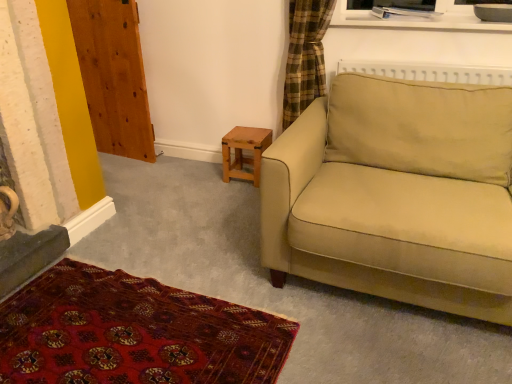
What are the coordinates of `beige fabric couch at right` in the screenshot? It's located at (396, 194).

Describe the element at coordinates (134, 333) in the screenshot. I see `carpet with intricate patterns at lower left` at that location.

The width and height of the screenshot is (512, 384). What do you see at coordinates (113, 76) in the screenshot?
I see `wooden at left` at bounding box center [113, 76].

This screenshot has height=384, width=512. I want to click on wooden stool at lower center, so click(x=242, y=153).

Considering the sizes of objects carpet with intricate patterns at lower left and wooden at left in the image provided, who is bigger, carpet with intricate patterns at lower left or wooden at left?

wooden at left is bigger.

Which object is thinner, carpet with intricate patterns at lower left or wooden at left?

Thinner between the two is wooden at left.

From the image's perspective, does carpet with intricate patterns at lower left appear higher than wooden at left?

No.

How different are the orientations of carpet with intricate patterns at lower left and wooden at left in degrees?

96.3 degrees.

What's the angular difference between wooden stool at lower center and beige fabric couch at right's facing directions?

The angle between the facing direction of wooden stool at lower center and the facing direction of beige fabric couch at right is 1.72 degrees.

How distant is wooden stool at lower center from beige fabric couch at right?

The distance of wooden stool at lower center from beige fabric couch at right is 36.25 inches.

In the scene shown: Is wooden stool at lower center beside beige fabric couch at right?

No.

This screenshot has width=512, height=384. What are the coordinates of `table that is above the beige fabric couch at right (from the image's perspective)` in the screenshot? It's located at (242, 153).

Between point (127, 34) and point (240, 139), which one is positioned in front?

The point (240, 139) is more forward.

Between wooden at left and wooden stool at lower center, which one appears on the right side from the viewer's perspective?

Positioned to the right is wooden stool at lower center.

Looking at this image, how many degrees apart are the facing directions of wooden at left and wooden stool at lower center?

The facing directions of wooden at left and wooden stool at lower center are 10.5 degrees apart.

Considering the sizes of wooden at left and wooden stool at lower center in the image, is wooden at left wider or thinner than wooden stool at lower center?

Considering their sizes, wooden at left looks slimmer than wooden stool at lower center.

Visually, is beige fabric couch at right positioned to the left or to the right of wooden stool at lower center?

beige fabric couch at right is positioned on wooden stool at lower center's right side.

Locate an element on the screen. table behind the beige fabric couch at right is located at coordinates (242, 153).

Is beige fabric couch at right looking in the opposite direction of wooden stool at lower center?

beige fabric couch at right does not have its back to wooden stool at lower center.

Which object is thinner, beige fabric couch at right or wooden stool at lower center?

With smaller width is wooden stool at lower center.

Consider the image. From a real-world perspective, which object stands above the other?

From a 3D spatial view, beige fabric couch at right is above.

Would you say beige fabric couch at right is part of carpet with intricate patterns at lower left's contents?

Definitely not — beige fabric couch at right is not inside carpet with intricate patterns at lower left.

Can you tell me how much carpet with intricate patterns at lower left and beige fabric couch at right differ in facing direction?

87.5 degrees separate the facing orientations of carpet with intricate patterns at lower left and beige fabric couch at right.

The image size is (512, 384). In order to click on plain below the beige fabric couch at right (from a real-world perspective) in this screenshot , I will do `click(134, 333)`.

Between beige fabric couch at right and carpet with intricate patterns at lower left, which one is positioned in front?

beige fabric couch at right.

From a real-world perspective, which object stands above the other?

beige fabric couch at right is physically above.

Between beige fabric couch at right and carpet with intricate patterns at lower left, which one has larger width?

Wider between the two is carpet with intricate patterns at lower left.

What's the angular difference between wooden at left and beige fabric couch at right's facing directions?

The angular difference between wooden at left and beige fabric couch at right is 8.74 degrees.

Is wooden at left directly adjacent to beige fabric couch at right?

wooden at left and beige fabric couch at right are not in contact.

Identify the location of armoire above the beige fabric couch at right (from a real-world perspective). This screenshot has height=384, width=512. [x=113, y=76].

From the picture: From the image's perspective, is wooden at left positioned above or below beige fabric couch at right?

Clearly, from the image's perspective, wooden at left is above beige fabric couch at right.

Identify the location of plain that appears below the wooden at left (from the image's perspective). (134, 333).

This screenshot has height=384, width=512. What are the coordinates of `table that appears behind the beige fabric couch at right` in the screenshot? It's located at (242, 153).

Estimate the real-world distances between objects in this image. Which object is closer to wooden stool at lower center, wooden at left or carpet with intricate patterns at lower left?

Among the two, wooden at left is located nearer to wooden stool at lower center.

When comparing their distances from wooden at left, does carpet with intricate patterns at lower left or wooden stool at lower center seem closer?

Based on the image, wooden stool at lower center appears to be nearer to wooden at left.

Which object lies further to the anchor point wooden at left, wooden stool at lower center or beige fabric couch at right?

beige fabric couch at right.

Based on their spatial positions, is carpet with intricate patterns at lower left or wooden at left further from wooden stool at lower center?

carpet with intricate patterns at lower left is positioned further to the anchor wooden stool at lower center.

Looking at the image, which one is located closer to wooden stool at lower center, carpet with intricate patterns at lower left or beige fabric couch at right?

beige fabric couch at right is closer to wooden stool at lower center.

Which object lies further to the anchor point carpet with intricate patterns at lower left, wooden at left or beige fabric couch at right?

Among the two, wooden at left is located further to carpet with intricate patterns at lower left.

In the scene shown: Which object lies nearer to the anchor point beige fabric couch at right, wooden at left or carpet with intricate patterns at lower left?

Among the two, carpet with intricate patterns at lower left is located nearer to beige fabric couch at right.

Which object lies nearer to the anchor point wooden at left, beige fabric couch at right or carpet with intricate patterns at lower left?

The object closer to wooden at left is carpet with intricate patterns at lower left.

You are a GUI agent. You are given a task and a screenshot of the screen. Output one action in this format:
    pyautogui.click(x=<x>, y=<y>)
    Task: Click on the armoire between carpet with intricate patterns at lower left and wooden stool at lower center from front to back
    This screenshot has height=384, width=512.
    Given the screenshot: What is the action you would take?
    pyautogui.click(x=113, y=76)

The image size is (512, 384). Find the location of `plain located between wooden at left and beige fabric couch at right in the left-right direction`. plain located between wooden at left and beige fabric couch at right in the left-right direction is located at coordinates (134, 333).

Image resolution: width=512 pixels, height=384 pixels. Find the location of `plain positioned between beige fabric couch at right and wooden stool at lower center from near to far`. plain positioned between beige fabric couch at right and wooden stool at lower center from near to far is located at coordinates (134, 333).

This screenshot has width=512, height=384. Identify the location of table between wooden at left and beige fabric couch at right from left to right. (242, 153).